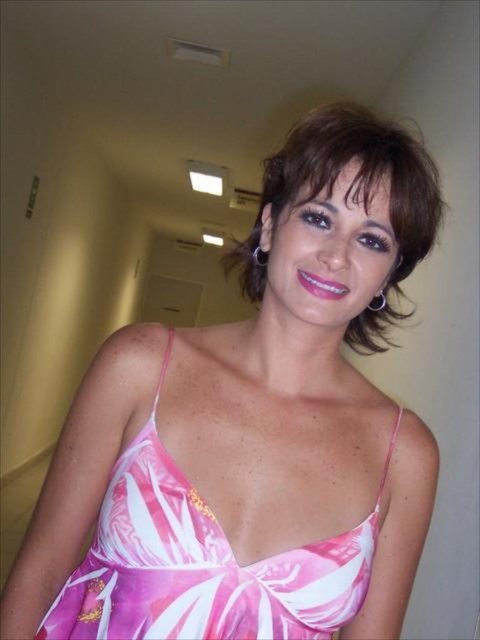
Question: Can you confirm if pink floral fabric dress at center is wider than brown hair at upper center?

Choices:
 (A) no
 (B) yes

Answer: (B)

Question: Which object is farther from the camera taking this photo?

Choices:
 (A) pink floral fabric dress at center
 (B) brown hair at upper center

Answer: (A)

Question: Considering the real-world distances, which object is farthest from the brown hair at upper center?

Choices:
 (A) pink floral fabric dress at center
 (B) brown smooth hair at center

Answer: (A)

Question: Which of the following is the farthest from the observer?

Choices:
 (A) pink floral fabric dress at center
 (B) brown hair at upper center
 (C) brown smooth hair at center

Answer: (A)

Question: Does brown smooth hair at center have a lesser width compared to brown hair at upper center?

Choices:
 (A) no
 (B) yes

Answer: (A)

Question: Can you confirm if brown smooth hair at center is wider than brown hair at upper center?

Choices:
 (A) no
 (B) yes

Answer: (B)